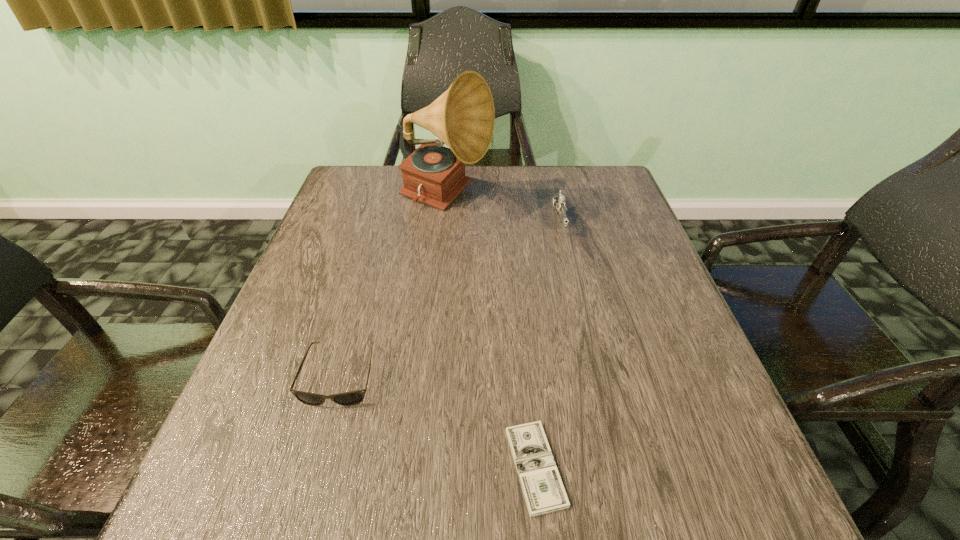
I want to click on object identified as the second closest to the nearest object, so click(x=559, y=202).

Where is `object identified as the second closest to the sunglasses`? This screenshot has height=540, width=960. object identified as the second closest to the sunglasses is located at coordinates (463, 117).

Identify the location of vacant space that satisfies the following two spatial constraints: 1. on the lenses of the third tallest object; 2. on the left side of the dollar. (314, 467).

Where is `free point that satisfies the following two spatial constraints: 1. on the horn of the tallest object; 2. on the lenses of the sunglasses`? free point that satisfies the following two spatial constraints: 1. on the horn of the tallest object; 2. on the lenses of the sunglasses is located at coordinates (427, 375).

Locate an element on the screen. vacant position in the image that satisfies the following two spatial constraints: 1. on the lenses of the dollar; 2. on the right side of the second nearest object is located at coordinates (314, 467).

At what (x,y) coordinates should I click in order to perform the action: click on vacant point that satisfies the following two spatial constraints: 1. on the lenses of the shortest object; 2. on the left side of the second shortest object. Please return your answer as a coordinate pair (x, y). The image size is (960, 540). Looking at the image, I should click on (314, 467).

Locate an element on the screen. vacant point that satisfies the following two spatial constraints: 1. on the horn of the phonograph record; 2. on the back side of the dollar is located at coordinates pyautogui.click(x=418, y=467).

Locate an element on the screen. The height and width of the screenshot is (540, 960). blank space that satisfies the following two spatial constraints: 1. on the lenses of the third farthest object; 2. on the right side of the shortest object is located at coordinates (314, 467).

Identify the location of vacant space that satisfies the following two spatial constraints: 1. on the horn of the phonograph record; 2. on the right side of the dollar. (418, 467).